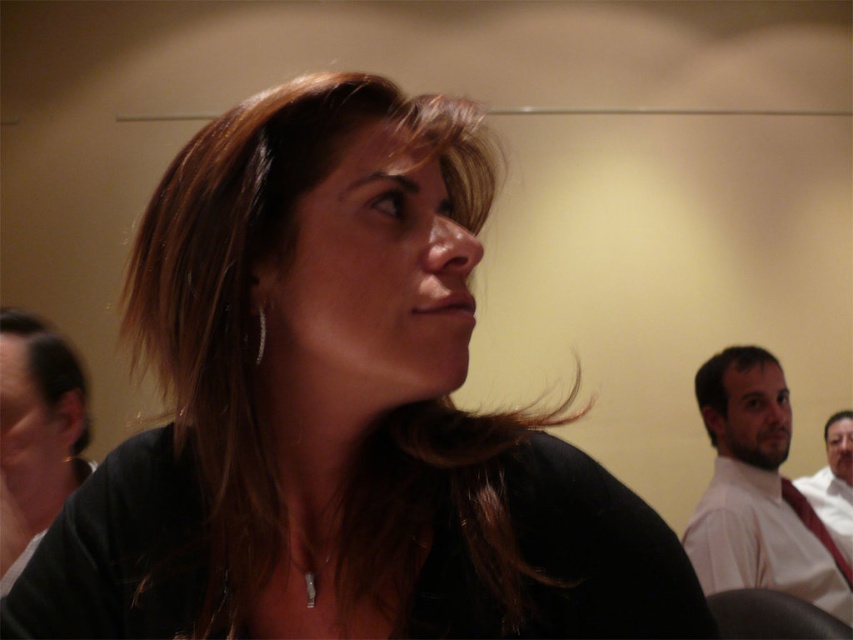
You are a photographer setting up for a group photo. You notice the smooth white shirt at right and the brownhair at left in your frame. Which subject should you adjust to ensure both appear proportionally sized in the final shot?

The smooth white shirt at right has a greater height compared to brownhair at left. To make them proportionally sized, you should adjust the smooth white shirt at right to be shorter or move it closer to the camera, while ensuring the brownhair at left remains in its current position.

You are an artist trying to sketch this scene. You need to place the dark brown hair at right in your drawing. What are the coordinates where you should position it?

The dark brown hair at right should be placed at coordinates 0.584 on the x axis and 0.850 on the y axis.

You are a photographer at a formal event. You need to adjust the lighting to ensure both the smooth white shirt at right and the brownhair at left are well lit. Based on their positions, which direction should you move the light source to evenly illuminate both?

The smooth white shirt at right is to the right of brownhair at left. To evenly illuminate both, move the light source towards the center between them so that the light can reach both the right and left sides of the frame.